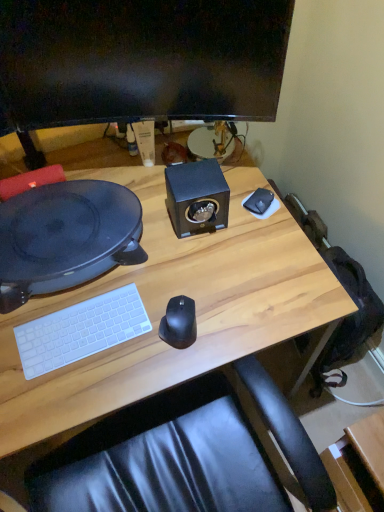
Find the location of a particular element. The height and width of the screenshot is (512, 384). vacant area that lies between black matte mouse at center and white matte mousepad at upper right is located at coordinates (220, 263).